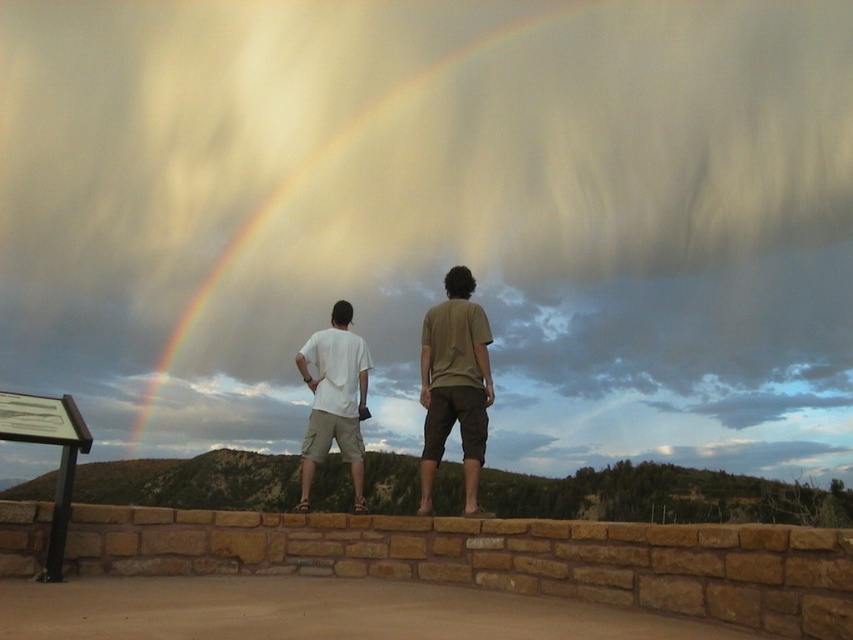
Question: Considering the relative positions of matte brown t-shirt at center and rainbow at upper center in the image provided, where is matte brown t-shirt at center located with respect to rainbow at upper center?

Choices:
 (A) above
 (B) below

Answer: (B)

Question: Does brown stone ledge at center appear on the right side of matte white t-shirt at center?

Choices:
 (A) no
 (B) yes

Answer: (B)

Question: Which point is closer to the camera?

Choices:
 (A) (306, 339)
 (B) (309, 176)
 (C) (44, 552)

Answer: (C)

Question: Which point is closer to the camera?

Choices:
 (A) rainbow at upper center
 (B) brown stone ledge at center
 (C) matte brown t-shirt at center

Answer: (B)

Question: Which of the following is the closest to the observer?

Choices:
 (A) brown stone ledge at center
 (B) rainbow at upper center
 (C) matte brown t-shirt at center
 (D) matte white t-shirt at center

Answer: (A)

Question: Can you confirm if brown stone ledge at center is positioned to the left of matte white t-shirt at center?

Choices:
 (A) no
 (B) yes

Answer: (A)